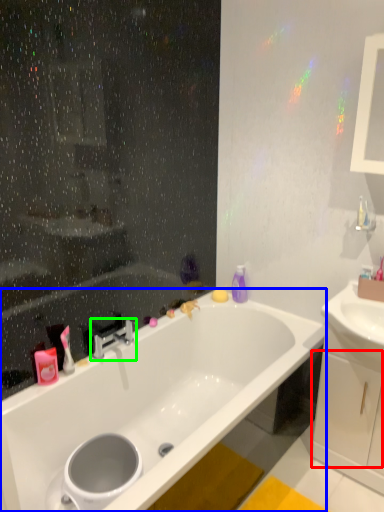
Question: Based on their relative distances, which object is nearer to drawer (highlighted by a red box)? Choose from bathtub (highlighted by a blue box) and tap (highlighted by a green box).

Choices:
 (A) bathtub
 (B) tap

Answer: (A)